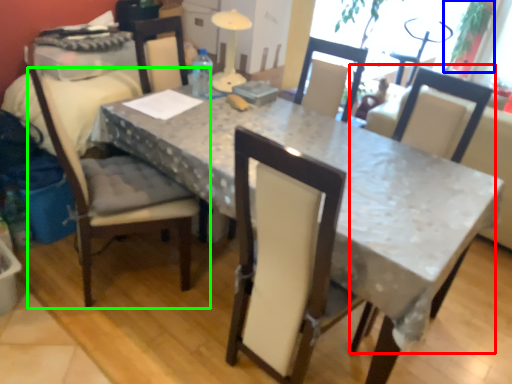
Question: Estimate the real-world distances between objects in this image. Which object is farther from chair (highlighted by a red box), plant (highlighted by a blue box) or chair (highlighted by a green box)?

Choices:
 (A) plant
 (B) chair

Answer: (A)